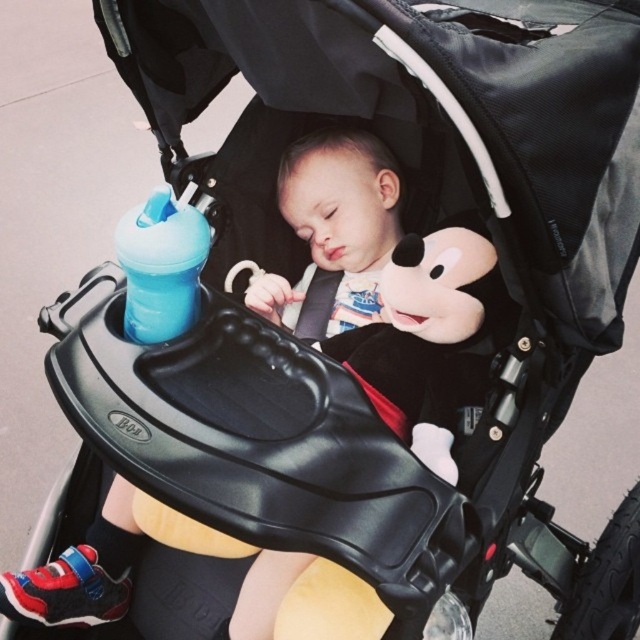
Question: Is soft plush mickey mouse at center wider than blue plastic bottle at upper left?

Choices:
 (A) yes
 (B) no

Answer: (A)

Question: Is soft plush mickey mouse at center positioned before blue plastic bottle at upper left?

Choices:
 (A) no
 (B) yes

Answer: (A)

Question: Which of the following is the farthest from the observer?

Choices:
 (A) blue plastic bottle at upper left
 (B) soft plush mickey mouse at center

Answer: (B)

Question: In this image, where is soft plush mickey mouse at center located relative to blue plastic bottle at upper left?

Choices:
 (A) right
 (B) left

Answer: (A)